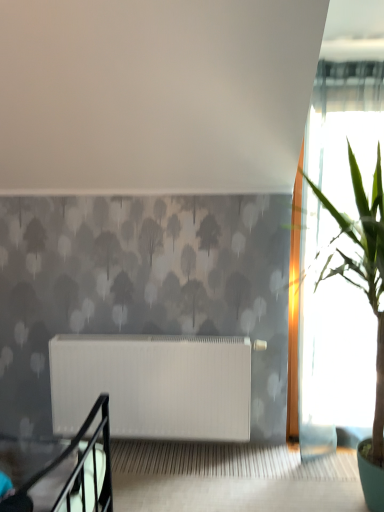
Question: Is point (87, 411) positioned closer to the camera than point (336, 210)?

Choices:
 (A) farther
 (B) closer

Answer: (A)

Question: Considering the positions of white matte radiator at center and green leafy plant at right in the image, is white matte radiator at center bigger or smaller than green leafy plant at right?

Choices:
 (A) small
 (B) big

Answer: (A)

Question: Would you say white matte radiator at center is to the left or to the right of green leafy plant at right in the picture?

Choices:
 (A) right
 (B) left

Answer: (B)

Question: Is green leafy plant at right wider or thinner than white matte radiator at center?

Choices:
 (A) thin
 (B) wide

Answer: (B)

Question: From their relative heights in the image, would you say green leafy plant at right is taller or shorter than white matte radiator at center?

Choices:
 (A) tall
 (B) short

Answer: (A)

Question: From a real-world perspective, is green leafy plant at right above or below white matte radiator at center?

Choices:
 (A) above
 (B) below

Answer: (A)

Question: Would you say green leafy plant at right is to the left or to the right of white matte radiator at center in the picture?

Choices:
 (A) right
 (B) left

Answer: (A)